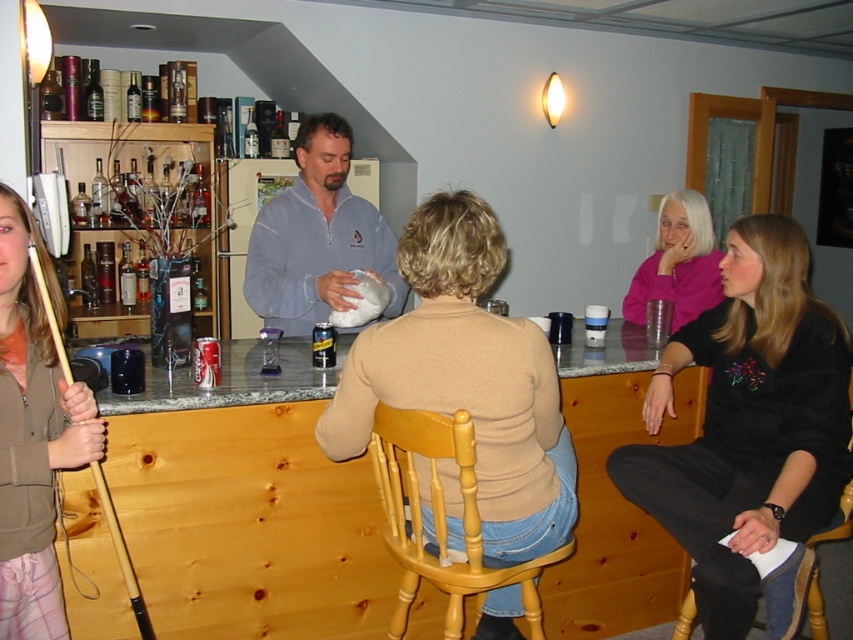
Between point (750, 305) and point (547, 420), which one is positioned in front?

Point (547, 420)

Who is positioned more to the left, black velvet sweater at upper right or beige sweater at center?

From the viewer's perspective, beige sweater at center appears more on the left side.

In the scene shown: Who is more forward, (761,241) or (527,557)?

Positioned in front is point (527,557).

Identify the location of black velvet sweater at upper right. (747, 422).

Consider the image. Is matte blue sweater at center above pink matte sweater at upper right?

Indeed, matte blue sweater at center is positioned over pink matte sweater at upper right.

Which is below, matte blue sweater at center or pink matte sweater at upper right?

Positioned lower is pink matte sweater at upper right.

Find the location of a particular element. The width and height of the screenshot is (853, 640). matte blue sweater at center is located at coordinates (317, 237).

What are the coordinates of `matte blue sweater at center` in the screenshot? It's located at (317, 237).

Who is positioned more to the right, brown plaid pajama pants at lower left or pink matte sweater at upper right?

pink matte sweater at upper right is more to the right.

Is point (15, 378) closer to viewer compared to point (706, 256)?

Yes, it is.

Is point (85, 410) positioned behind point (640, 314)?

That is False.

Locate an element on the screen. This screenshot has height=640, width=853. brown plaid pajama pants at lower left is located at coordinates (33, 433).